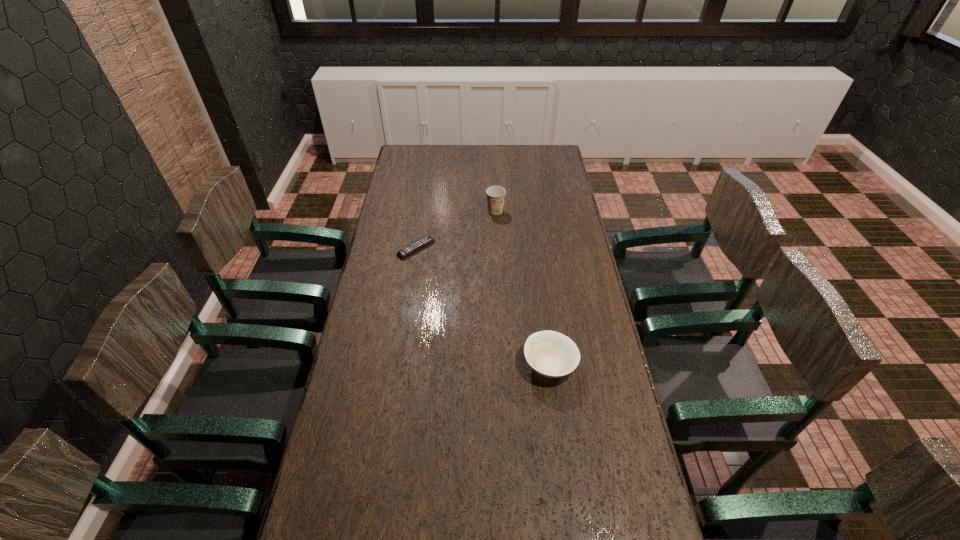
This screenshot has width=960, height=540. Identify the location of Dixie cup. (495, 194).

Where is `the second object from left to right`? This screenshot has height=540, width=960. the second object from left to right is located at coordinates (495, 194).

Identify the location of the rightmost object. (551, 354).

Where is `the nearest object`? Image resolution: width=960 pixels, height=540 pixels. the nearest object is located at coordinates (551, 354).

Locate an element on the screen. This screenshot has height=540, width=960. the leftmost object is located at coordinates (422, 242).

Locate an element on the screen. The height and width of the screenshot is (540, 960). the shortest object is located at coordinates (422, 242).

Where is `free point located 0.190m on the left of the second object from left to right`? The width and height of the screenshot is (960, 540). free point located 0.190m on the left of the second object from left to right is located at coordinates (444, 211).

The width and height of the screenshot is (960, 540). I want to click on vacant space located on the left of the rightmost object, so click(x=461, y=365).

Where is `free space located on the back of the leftmost object`? The width and height of the screenshot is (960, 540). free space located on the back of the leftmost object is located at coordinates (422, 210).

This screenshot has width=960, height=540. I want to click on object present at the left edge, so click(x=422, y=242).